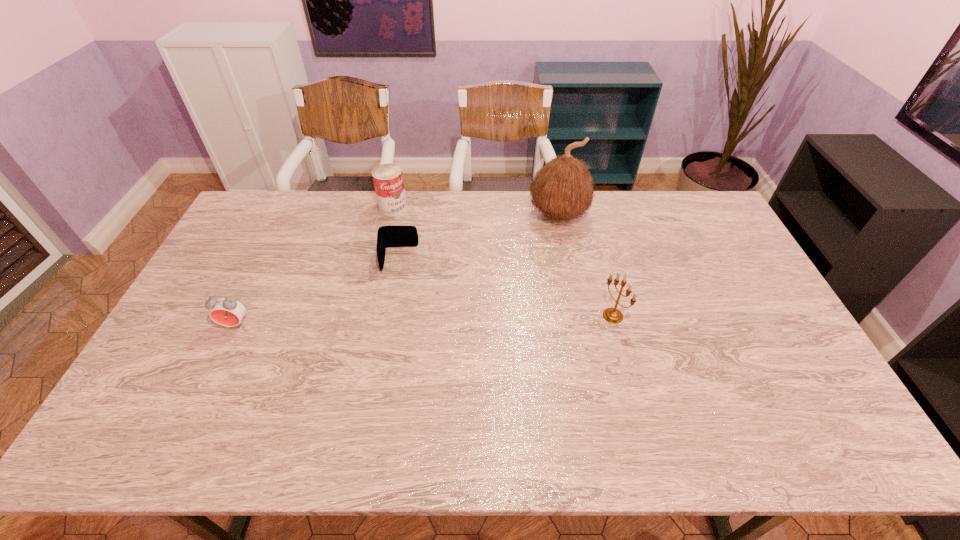
Find the location of `vacant space located on the surface of the tallest object`. vacant space located on the surface of the tallest object is located at coordinates (500, 284).

The width and height of the screenshot is (960, 540). Find the location of `vacant space located 0.370m on the surface of the tallest object`. vacant space located 0.370m on the surface of the tallest object is located at coordinates (489, 298).

Find the location of a particular element. The height and width of the screenshot is (540, 960). vacant region located 0.330m on the outer surface of the third farthest object is located at coordinates (392, 360).

Where is `blank space located on the outer surface of the third farthest object`? The width and height of the screenshot is (960, 540). blank space located on the outer surface of the third farthest object is located at coordinates (396, 294).

Where is `free location located 0.300m on the outer surface of the third farthest object`? Image resolution: width=960 pixels, height=540 pixels. free location located 0.300m on the outer surface of the third farthest object is located at coordinates (393, 351).

The width and height of the screenshot is (960, 540). What are the coordinates of `vacant area situated 0.100m on the front label of the can` in the screenshot? It's located at (410, 230).

Where is `free space located on the front label of the can`? Image resolution: width=960 pixels, height=540 pixels. free space located on the front label of the can is located at coordinates (404, 222).

You are a GUI agent. You are given a task and a screenshot of the screen. Output one action in this format:
    pyautogui.click(x=<x>, y=<y>)
    Task: Click on the vacant space situated 0.260m on the front label of the can
    
    Given the screenshot: What is the action you would take?
    click(x=430, y=256)

This screenshot has width=960, height=540. In order to click on coconut present at the far edge in this screenshot , I will do `click(563, 189)`.

You are a GUI agent. You are given a task and a screenshot of the screen. Output one action in this format:
    pyautogui.click(x=<x>, y=<y>)
    Task: Click on the can positioned at the far edge
    
    Given the screenshot: What is the action you would take?
    pyautogui.click(x=388, y=181)